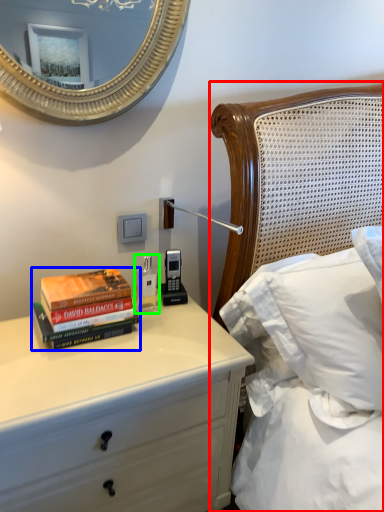
Question: Which object is positioned farthest from bed (highlighted by a red box)? Select from book (highlighted by a blue box) and bottle (highlighted by a green box).

Choices:
 (A) book
 (B) bottle

Answer: (A)